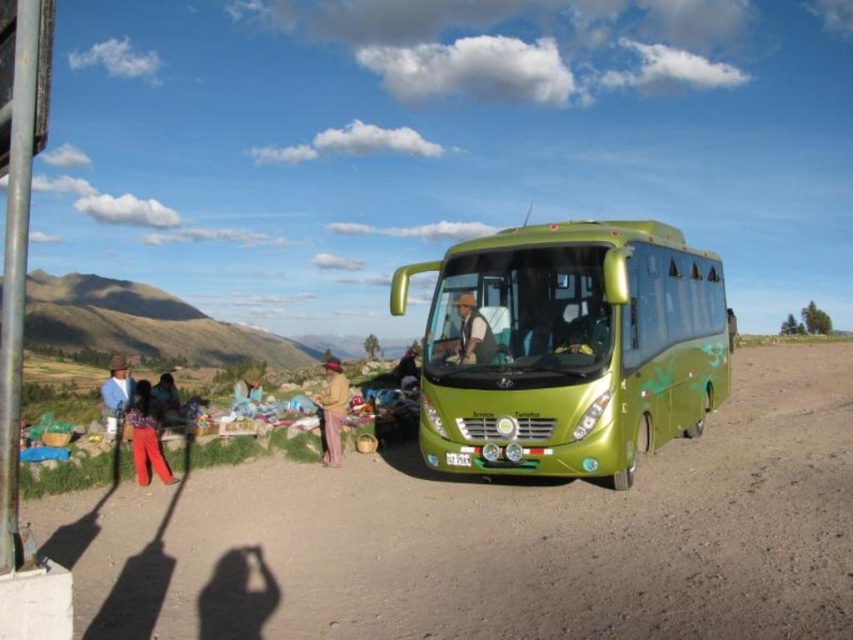
You are a pedestrian standing on the green rubber dirt track at center. You want to walk to the green metallic bus at center. Which direction should you walk to get closer to the bus?

The green rubber dirt track at center is closer to the viewer than the green metallic bus at center, so you should walk away from the track towards the bus to reach it.

You are standing at the center of the dirt road in the rural scene. There is a point marked at coordinates (473, 333). Which object is this point located on?

The point at coordinates (473, 333) is located on the matte green bus at center.

You are a photographer planning to take a photo of the metal pole at left and the matte red pants at lower left. Which object should you focus on first if you want to capture both in the same frame without moving the camera?

The metal pole at left is larger in size than the matte red pants at lower left, so focusing on the metal pole at left first would ensure it is properly framed before adjusting for the smaller matte red pants at lower left.